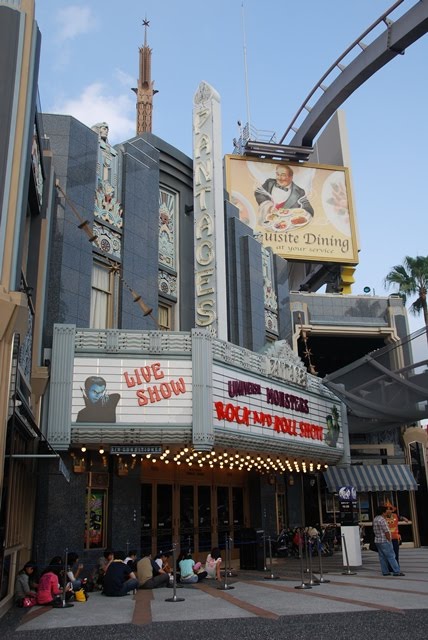
At what (x,y) coordinates should I click in order to perform the action: click on booth. Please return your answer as a coordinate pair (x, y). The width and height of the screenshot is (428, 640). Looking at the image, I should click on pyautogui.click(x=380, y=479).